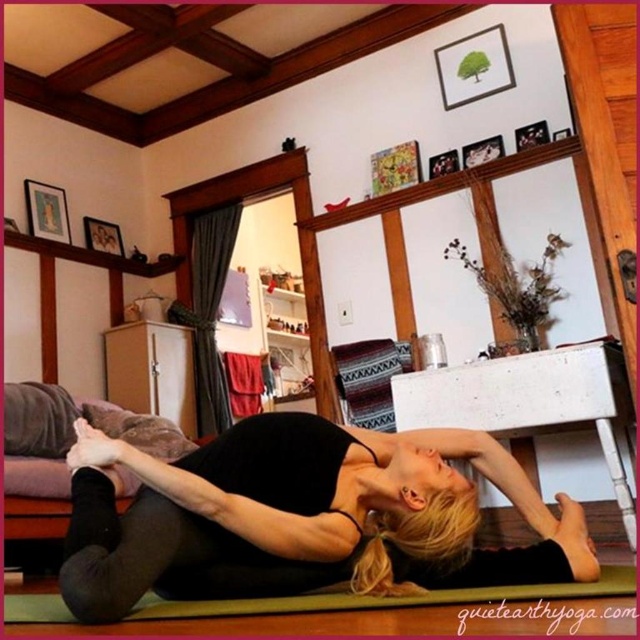
You are a virtual assistant helping someone set up their home yoga studio. They want to place a new yoga block exactly 0.1 units to the right of the black matte yoga mat at center. What coordinates should they use for the block?

The coordinates for the yoga block should be approximately 0.909 in the x direction and 0.469 in the y direction, since the black matte yoga mat at center is at point [300,516]. Adding 0.1 to the x coordinate gives the new position.

You are a fitness instructor preparing to demonstrate a yoga pose. You need to ensure there is enough space between the black matte yoga mat at center and the green rubber yoga mat at lower center for a participant to comfortably lie down. If the participant requires a minimum of 10 inches of space, can they fit between them?

The distance between the black matte yoga mat at center and the green rubber yoga mat at lower center is 8.71 inches, which is less than the required 10 inches. Therefore, the participant cannot comfortably lie down between them with the needed space.

You are a yoga instructor observing the scene. You need to place a 1.5 meter long yoga block between the black matte yoga mat at center and the green rubber yoga mat at lower center. Can the block fit between them vertically?

The black matte yoga mat at center is taller than the green rubber yoga mat at lower center. Since the block is 1.5 meters long, it cannot fit vertically between them because the height difference between the two mats is less than 1.5 meters.